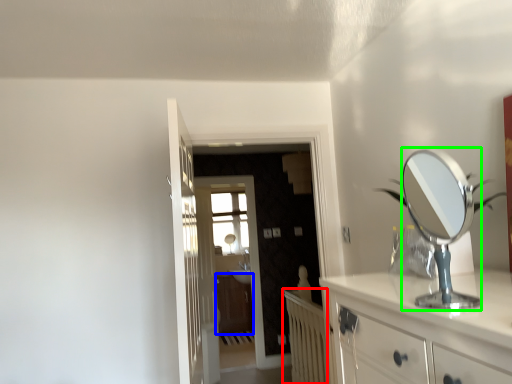
Question: Which is farther away from radiator (highlighted by a red box)? cabinetry (highlighted by a blue box) or mirror (highlighted by a green box)?

Choices:
 (A) cabinetry
 (B) mirror

Answer: (B)